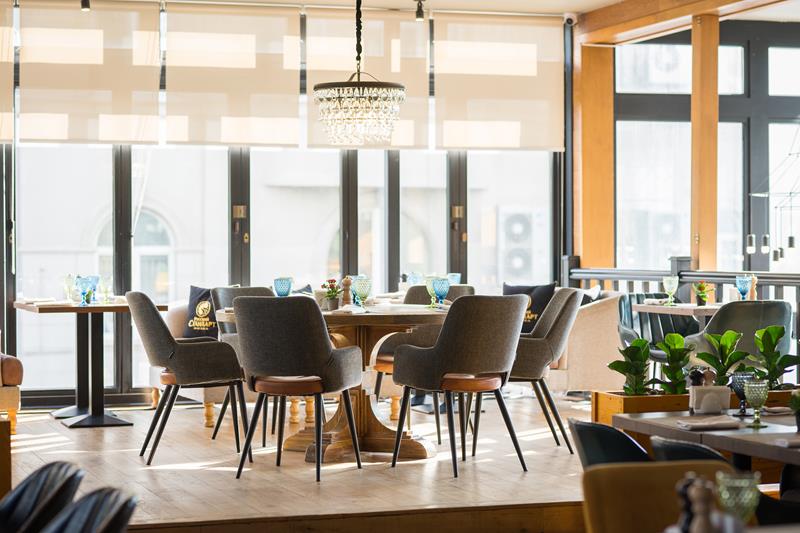
The image size is (800, 533). I want to click on potted plants, so click(x=637, y=365), click(x=673, y=361), click(x=724, y=361), click(x=773, y=357), click(x=702, y=292), click(x=337, y=292).